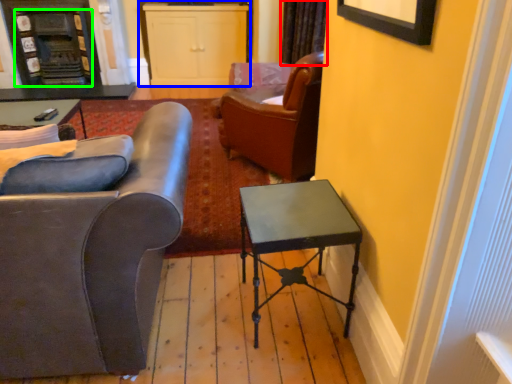
Question: Which is nearer to the curtain (highlighted by a red box)? cabinetry (highlighted by a blue box) or fireplace (highlighted by a green box).

Choices:
 (A) cabinetry
 (B) fireplace

Answer: (A)